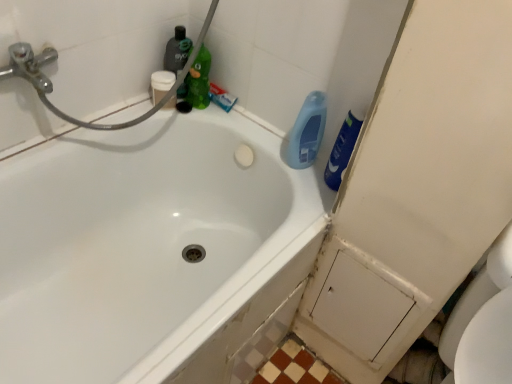
Question: Is the depth of green matte bottle at upper center, which is the 2th cleaning product from left to right, greater than that of blue matte toothpaste at upper center?

Choices:
 (A) yes
 (B) no

Answer: (B)

Question: From the image's perspective, would you say green matte bottle at upper center, the third cleaning product from the right, is positioned over blue matte toothpaste at upper center?

Choices:
 (A) yes
 (B) no

Answer: (A)

Question: Can you confirm if green matte bottle at upper center, which is the 2th cleaning product from left to right, is positioned to the right of blue matte toothpaste at upper center?

Choices:
 (A) no
 (B) yes

Answer: (A)

Question: Does green matte bottle at upper center, the third cleaning product from the right, appear on the left side of blue matte toothpaste at upper center?

Choices:
 (A) no
 (B) yes

Answer: (B)

Question: Considering the relative sizes of green matte bottle at upper center, the third cleaning product from the right, and blue matte toothpaste at upper center in the image provided, is green matte bottle at upper center, the third cleaning product from the right, thinner than blue matte toothpaste at upper center?

Choices:
 (A) yes
 (B) no

Answer: (A)

Question: In terms of width, does green matte bottle at upper center, the third cleaning product from the right, look wider or thinner when compared to blue glossy bottle at upper right, marked as the 2th cleaning product in a right-to-left arrangement?

Choices:
 (A) wide
 (B) thin

Answer: (A)

Question: From a real-world perspective, is green matte bottle at upper center, which is the 2th cleaning product from left to right, positioned above or below blue glossy bottle at upper right, marked as the 2th cleaning product in a right-to-left arrangement?

Choices:
 (A) below
 (B) above

Answer: (A)

Question: Considering their positions, is green matte bottle at upper center, which is the 2th cleaning product from left to right, located in front of or behind blue glossy bottle at upper right, which appears as the third cleaning product when viewed from the left?

Choices:
 (A) front
 (B) behind

Answer: (B)

Question: From the image's perspective, is green matte bottle at upper center, the third cleaning product from the right, located above or below blue glossy bottle at upper right, marked as the 2th cleaning product in a right-to-left arrangement?

Choices:
 (A) below
 (B) above

Answer: (B)

Question: Looking at their shapes, would you say white matte cup at upper left is wider or thinner than blue glossy bottle at upper right, which appears as the third cleaning product when viewed from the left?

Choices:
 (A) thin
 (B) wide

Answer: (B)

Question: Is white matte cup at upper left inside or outside of blue glossy bottle at upper right, marked as the 2th cleaning product in a right-to-left arrangement?

Choices:
 (A) inside
 (B) outside

Answer: (B)

Question: Considering the relative positions of white matte cup at upper left and blue glossy bottle at upper right, which appears as the third cleaning product when viewed from the left, in the image provided, is white matte cup at upper left to the left or to the right of blue glossy bottle at upper right, which appears as the third cleaning product when viewed from the left,?

Choices:
 (A) right
 (B) left

Answer: (B)

Question: In terms of height, does white matte cup at upper left look taller or shorter compared to blue glossy bottle at upper right, which appears as the third cleaning product when viewed from the left?

Choices:
 (A) tall
 (B) short

Answer: (B)

Question: Relative to white glossy bathtub at upper left, is white matte cup at upper left in front or behind?

Choices:
 (A) behind
 (B) front

Answer: (A)

Question: From the image's perspective, relative to white glossy bathtub at upper left, is white matte cup at upper left above or below?

Choices:
 (A) below
 (B) above

Answer: (B)